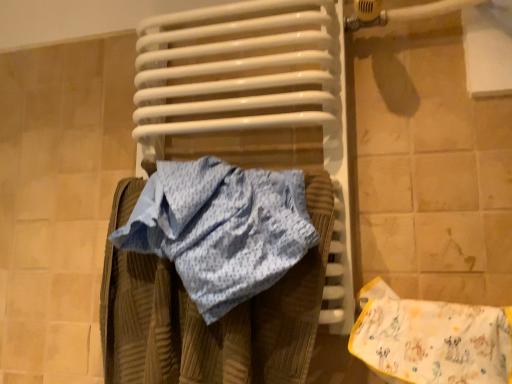
Question: Is yellow cotton bib at lower right positioned before white glossy radiator at center?

Choices:
 (A) yes
 (B) no

Answer: (A)

Question: Considering the relative positions of yellow cotton bib at lower right and white glossy radiator at center in the image provided, is yellow cotton bib at lower right to the right of white glossy radiator at center from the viewer's perspective?

Choices:
 (A) no
 (B) yes

Answer: (B)

Question: Is yellow cotton bib at lower right smaller than white glossy radiator at center?

Choices:
 (A) yes
 (B) no

Answer: (A)

Question: Is yellow cotton bib at lower right positioned behind white glossy radiator at center?

Choices:
 (A) yes
 (B) no

Answer: (B)

Question: Is yellow cotton bib at lower right not near white glossy radiator at center?

Choices:
 (A) no
 (B) yes

Answer: (A)

Question: Could you tell me if yellow cotton bib at lower right is turned towards white glossy radiator at center?

Choices:
 (A) yes
 (B) no

Answer: (B)

Question: Considering the relative sizes of white glossy radiator at center and yellow cotton bib at lower right in the image provided, is white glossy radiator at center taller than yellow cotton bib at lower right?

Choices:
 (A) yes
 (B) no

Answer: (A)

Question: Is there a large distance between white glossy radiator at center and yellow cotton bib at lower right?

Choices:
 (A) yes
 (B) no

Answer: (B)

Question: From a real-world perspective, is white glossy radiator at center positioned under yellow cotton bib at lower right based on gravity?

Choices:
 (A) no
 (B) yes

Answer: (A)

Question: Does white glossy radiator at center touch yellow cotton bib at lower right?

Choices:
 (A) no
 (B) yes

Answer: (A)

Question: Is white glossy radiator at center facing away from yellow cotton bib at lower right?

Choices:
 (A) yes
 (B) no

Answer: (B)

Question: Is yellow cotton bib at lower right a part of white glossy radiator at center?

Choices:
 (A) yes
 (B) no

Answer: (B)

Question: From the image's perspective, is yellow cotton bib at lower right positioned above or below white glossy radiator at center?

Choices:
 (A) below
 (B) above

Answer: (A)